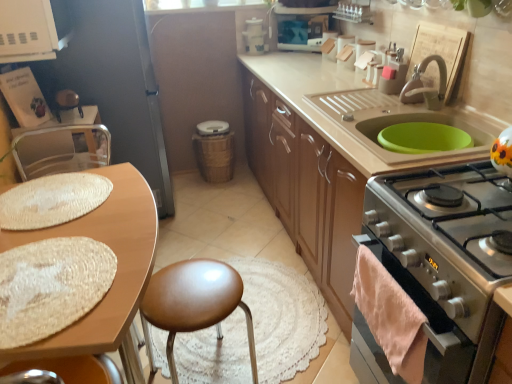
Question: Which direction should I rotate to look at woven brown trash can at center, which is the 1th appliance from back to front, — up or down?

Choices:
 (A) up
 (B) down

Answer: (A)

Question: Is satin silver oven at lower right not near metallic silver chair at left?

Choices:
 (A) no
 (B) yes

Answer: (B)

Question: From a real-world perspective, is satin silver oven at lower right located higher than metallic silver chair at left?

Choices:
 (A) no
 (B) yes

Answer: (A)

Question: Is satin silver oven at lower right looking in the opposite direction of metallic silver chair at left?

Choices:
 (A) no
 (B) yes

Answer: (A)

Question: Is satin silver oven at lower right closer to camera compared to metallic silver chair at left?

Choices:
 (A) yes
 (B) no

Answer: (A)

Question: From the image's perspective, is satin silver oven at lower right on top of metallic silver chair at left?

Choices:
 (A) yes
 (B) no

Answer: (B)

Question: From a real-world perspective, is satin silver oven at lower right under metallic silver chair at left?

Choices:
 (A) yes
 (B) no

Answer: (A)

Question: Considering the relative sizes of matte wood cabinets at center and woven brown trash can at center, which is the 1th appliance from back to front, in the image provided, is matte wood cabinets at center thinner than woven brown trash can at center, which is the 1th appliance from back to front,?

Choices:
 (A) yes
 (B) no

Answer: (B)

Question: Considering the relative positions of matte wood cabinets at center and woven brown trash can at center, positioned as the 1th appliance in bottom-to-top order, in the image provided, is matte wood cabinets at center in front of woven brown trash can at center, positioned as the 1th appliance in bottom-to-top order,?

Choices:
 (A) yes
 (B) no

Answer: (A)

Question: Is matte wood cabinets at center placed right next to woven brown trash can at center, which appears as the first appliance when viewed from the left?

Choices:
 (A) no
 (B) yes

Answer: (A)

Question: Is matte wood cabinets at center not inside woven brown trash can at center, which appears as the first appliance when viewed from the left?

Choices:
 (A) no
 (B) yes

Answer: (B)

Question: Could you tell me if matte wood cabinets at center is facing woven brown trash can at center, which is the 1th appliance from back to front?

Choices:
 (A) no
 (B) yes

Answer: (B)

Question: From a real-world perspective, is matte wood cabinets at center beneath woven brown trash can at center, arranged as the second appliance when viewed from the top?

Choices:
 (A) no
 (B) yes

Answer: (A)

Question: From a real-world perspective, is white plastic container at upper center, acting as the 2th appliance starting from the left, physically below woven brown trash can at center, arranged as the second appliance when viewed from the top?

Choices:
 (A) no
 (B) yes

Answer: (A)